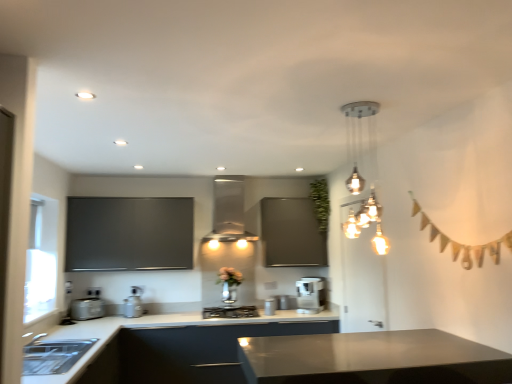
Identify the location of blank space situated above green leafy plant at upper center (from a real-world perspective). (314, 174).